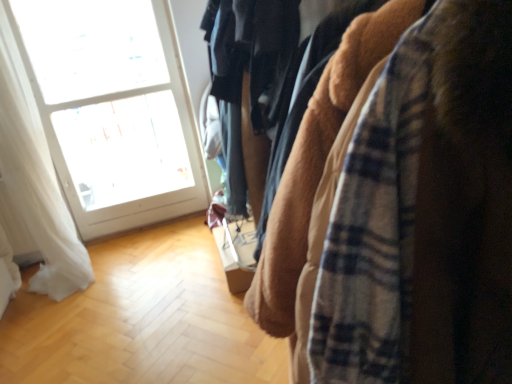
Question: Is point (68, 281) closer or farther from the camera than point (330, 339)?

Choices:
 (A) farther
 (B) closer

Answer: (A)

Question: Considering the relative positions of white sheer curtain at left and plaid flannel shirt at right in the image provided, is white sheer curtain at left to the left or to the right of plaid flannel shirt at right?

Choices:
 (A) right
 (B) left

Answer: (B)

Question: Considering the real-world distances, which object is closest to the plaid flannel shirt at right?

Choices:
 (A) white glass window at upper left
 (B) white sheer curtain at left

Answer: (B)

Question: Which object is positioned farthest from the white sheer curtain at left?

Choices:
 (A) white glass window at upper left
 (B) plaid flannel shirt at right

Answer: (B)